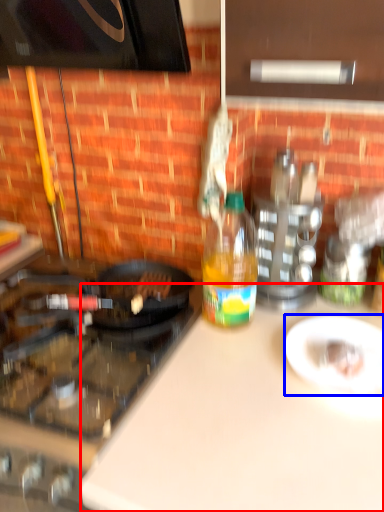
Question: Among these objects, which one is nearest to the camera, counter top (highlighted by a red box) or plate (highlighted by a blue box)?

Choices:
 (A) counter top
 (B) plate

Answer: (A)